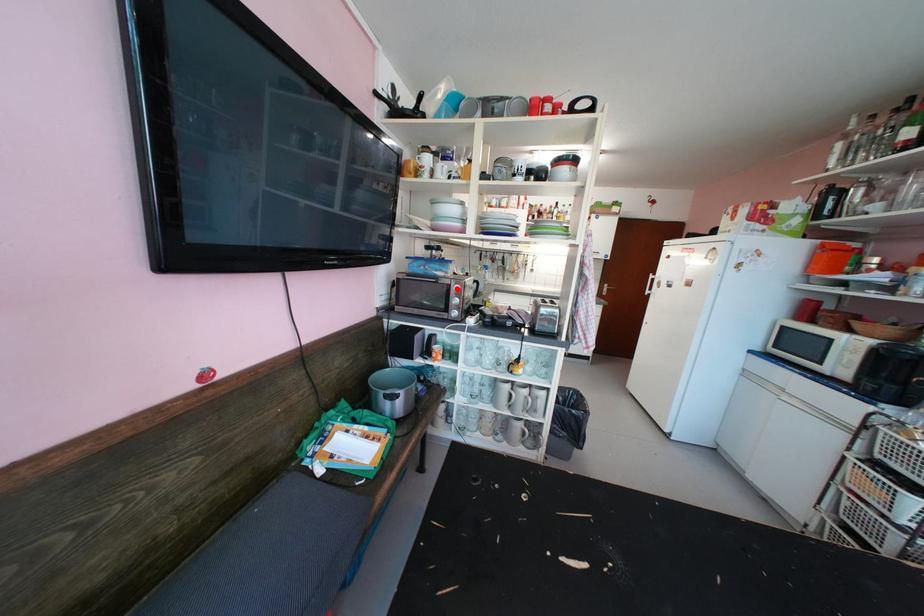
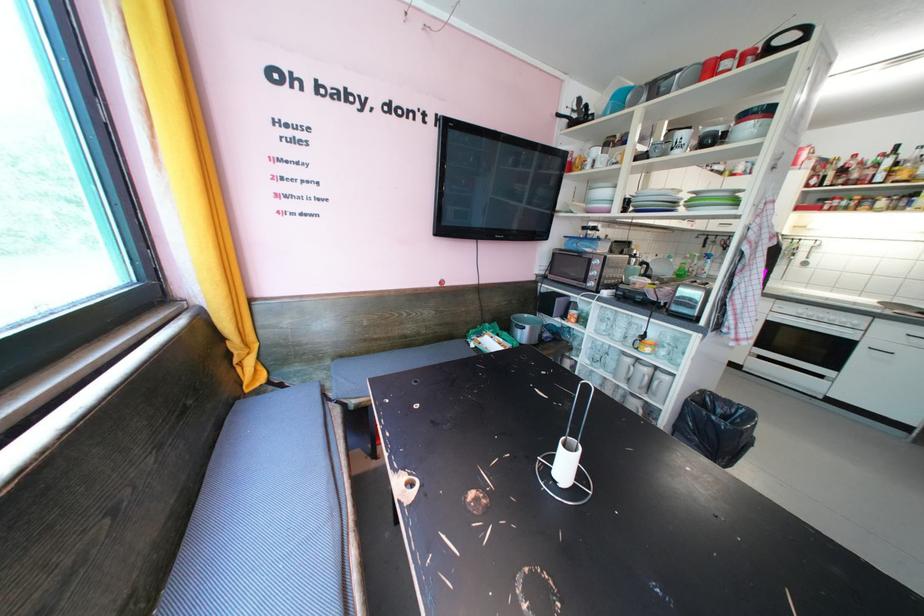
The point at the highlighted location is marked in the first image. Where is the corresponding point in the second image?

(599, 262)